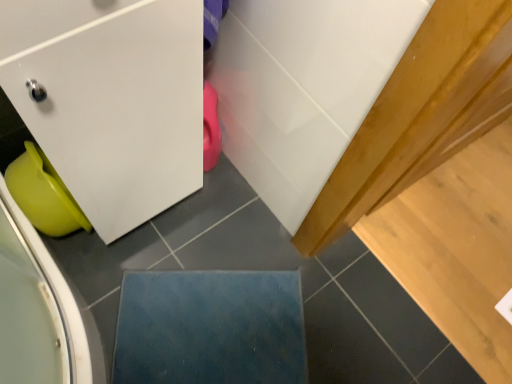
Locate an element on the screen. Image resolution: width=512 pixels, height=384 pixels. blue felt mat at lower center is located at coordinates (210, 328).

The image size is (512, 384). What do you see at coordinates (210, 328) in the screenshot? I see `blue felt mat at lower center` at bounding box center [210, 328].

In order to face blue felt mat at lower center, should I rotate leftwards or rightwards?

To align with it, rotate left about 5.731°.

Image resolution: width=512 pixels, height=384 pixels. Describe the element at coordinates (42, 194) in the screenshot. I see `matte green plastic toilet bowl at lower left` at that location.

Where is `matte green plastic toilet bowl at lower left`? The width and height of the screenshot is (512, 384). matte green plastic toilet bowl at lower left is located at coordinates (42, 194).

Where is `blue felt mat at lower center`? The image size is (512, 384). blue felt mat at lower center is located at coordinates pyautogui.click(x=210, y=328).

Is matte green plastic toilet bowl at lower left at the left side of blue felt mat at lower center?

Correct, you'll find matte green plastic toilet bowl at lower left to the left of blue felt mat at lower center.

In the image, is matte green plastic toilet bowl at lower left positioned in front of or behind blue felt mat at lower center?

In the image, matte green plastic toilet bowl at lower left appears in front of blue felt mat at lower center.

Which point is more forward, (60, 226) or (269, 371)?

Point (60, 226)

From the image's perspective, would you say matte green plastic toilet bowl at lower left is shown under blue felt mat at lower center?

No.

From a real-world perspective, which object rests below the other?

In real-world perspective, blue felt mat at lower center is lower.

In terms of width, does matte green plastic toilet bowl at lower left look wider or thinner when compared to blue felt mat at lower center?

In the image, matte green plastic toilet bowl at lower left appears to be more narrow than blue felt mat at lower center.

Considering the sizes of objects matte green plastic toilet bowl at lower left and blue felt mat at lower center in the image provided, who is taller, matte green plastic toilet bowl at lower left or blue felt mat at lower center?

With more height is matte green plastic toilet bowl at lower left.

Who is smaller, matte green plastic toilet bowl at lower left or blue felt mat at lower center?

blue felt mat at lower center.

Is matte green plastic toilet bowl at lower left spatially inside blue felt mat at lower center, or outside of it?

matte green plastic toilet bowl at lower left is outside blue felt mat at lower center.

Is matte green plastic toilet bowl at lower left directly adjacent to blue felt mat at lower center?

They are not placed beside each other.

Could you tell me if matte green plastic toilet bowl at lower left is turned towards blue felt mat at lower center?

No, matte green plastic toilet bowl at lower left does not turn towards blue felt mat at lower center.

How many degrees apart are the facing directions of matte green plastic toilet bowl at lower left and blue felt mat at lower center?

52.8 degrees separate the facing orientations of matte green plastic toilet bowl at lower left and blue felt mat at lower center.

Measure the distance between matte green plastic toilet bowl at lower left and blue felt mat at lower center.

matte green plastic toilet bowl at lower left is 15.76 inches away from blue felt mat at lower center.

At what (x,y) coordinates should I click in order to perform the action: click on toilet bowl above the blue felt mat at lower center (from the image's perspective). Please return your answer as a coordinate pair (x, y). Image resolution: width=512 pixels, height=384 pixels. Looking at the image, I should click on (42, 194).

Is blue felt mat at lower center at the right side of matte green plastic toilet bowl at lower left?

Indeed, blue felt mat at lower center is positioned on the right side of matte green plastic toilet bowl at lower left.

Which is in front, blue felt mat at lower center or matte green plastic toilet bowl at lower left?

matte green plastic toilet bowl at lower left is closer to the camera.

Is point (253, 329) positioned before point (26, 145)?

No, it is not.

From the image's perspective, between blue felt mat at lower center and matte green plastic toilet bowl at lower left, which one is located above?

matte green plastic toilet bowl at lower left appears higher in the image.

Based on the photo, from a real-world perspective, is blue felt mat at lower center on matte green plastic toilet bowl at lower left?

No, from a real-world perspective, blue felt mat at lower center is not over matte green plastic toilet bowl at lower left

Between blue felt mat at lower center and matte green plastic toilet bowl at lower left, which one has larger width?

blue felt mat at lower center is wider.

From the picture: Who is shorter, blue felt mat at lower center or matte green plastic toilet bowl at lower left?

With less height is blue felt mat at lower center.

Between blue felt mat at lower center and matte green plastic toilet bowl at lower left, which one has larger size?

With larger size is matte green plastic toilet bowl at lower left.

Do you think blue felt mat at lower center is within matte green plastic toilet bowl at lower left, or outside of it?

The correct answer is: outside.

Are blue felt mat at lower center and matte green plastic toilet bowl at lower left located far from each other?

blue felt mat at lower center is actually quite close to matte green plastic toilet bowl at lower left.

Is blue felt mat at lower center oriented towards matte green plastic toilet bowl at lower left?

No, blue felt mat at lower center is not turned towards matte green plastic toilet bowl at lower left.

How many degrees apart are the facing directions of blue felt mat at lower center and matte green plastic toilet bowl at lower left?

The angular difference between blue felt mat at lower center and matte green plastic toilet bowl at lower left is 52.8 degrees.

Where is `slate lying behind the matte green plastic toilet bowl at lower left`? The image size is (512, 384). slate lying behind the matte green plastic toilet bowl at lower left is located at coordinates (210, 328).

Locate an element on the screen. The height and width of the screenshot is (384, 512). slate behind the matte green plastic toilet bowl at lower left is located at coordinates (210, 328).

The width and height of the screenshot is (512, 384). I want to click on toilet bowl that appears in front of the blue felt mat at lower center, so click(42, 194).